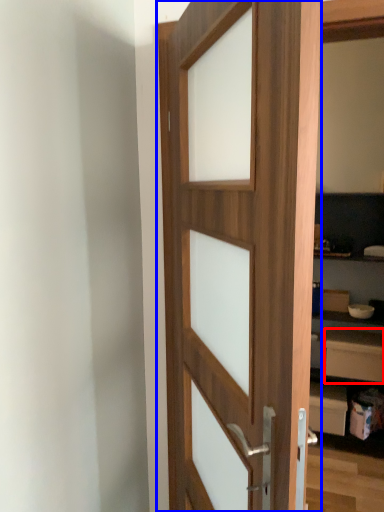
Question: Which of the following is the farthest to the observer, drawer (highlighted by a red box) or door (highlighted by a blue box)?

Choices:
 (A) drawer
 (B) door

Answer: (A)